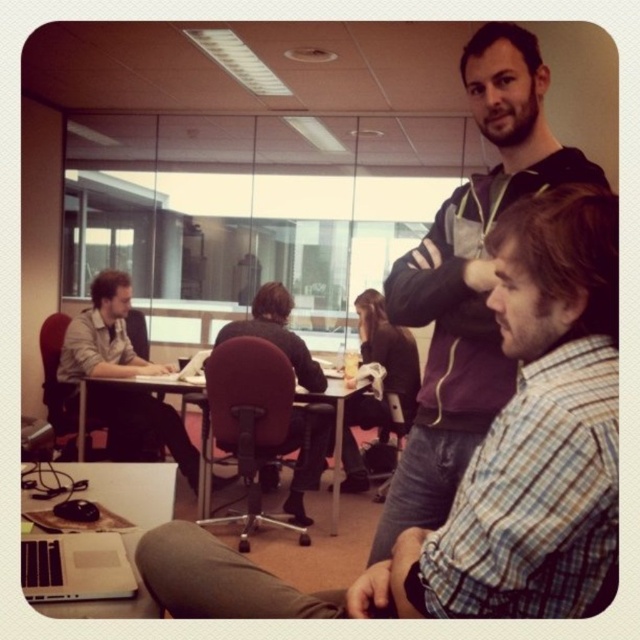
Does plaid cotton shirt at center have a lesser height compared to velvet-like maroon swivel chair at center?

Incorrect, plaid cotton shirt at center's height does not fall short of velvet-like maroon swivel chair at center's.

Who is lower down, plaid cotton shirt at center or velvet-like maroon swivel chair at center?

velvet-like maroon swivel chair at center

Which is in front, point (509, 140) or point (289, 384)?

Point (509, 140) is more forward.

Image resolution: width=640 pixels, height=640 pixels. I want to click on plaid cotton shirt at center, so click(468, 278).

The width and height of the screenshot is (640, 640). What do you see at coordinates (104, 337) in the screenshot?
I see `matte black shirt at left` at bounding box center [104, 337].

Is matte black shirt at left shorter than silver metallic laptop at lower left?

Incorrect, matte black shirt at left's height does not fall short of silver metallic laptop at lower left's.

Is point (74, 364) less distant than point (83, 572)?

No, it is not.

The width and height of the screenshot is (640, 640). In order to click on matte black shirt at left in this screenshot , I will do `click(104, 337)`.

Which of these two, velvet-like maroon swivel chair at center or silver metallic laptop at lower left, stands taller?

With more height is velvet-like maroon swivel chair at center.

Who is lower down, velvet-like maroon swivel chair at center or silver metallic laptop at lower left?

Positioned lower is velvet-like maroon swivel chair at center.

Is point (236, 444) positioned behind point (33, 576)?

That is True.

The width and height of the screenshot is (640, 640). Identify the location of velvet-like maroon swivel chair at center. (246, 424).